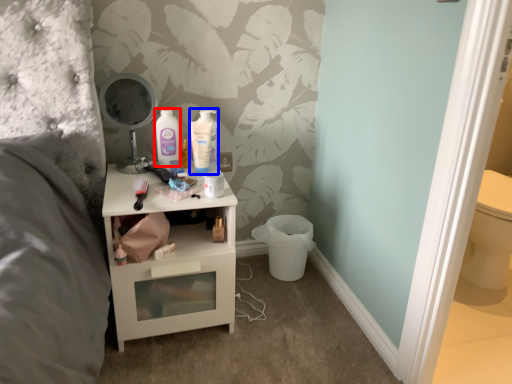
Question: Which point is further to the camera, mouthwash (highlighted by a red box) or mouthwash (highlighted by a blue box)?

Choices:
 (A) mouthwash
 (B) mouthwash

Answer: (B)